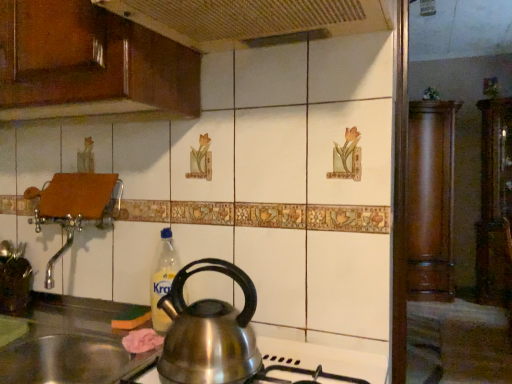
Question: Is shiny metallic kettle at center located within wooden panel at upper left?

Choices:
 (A) yes
 (B) no

Answer: (B)

Question: Is wooden panel at upper left positioned with its back to shiny metallic kettle at center?

Choices:
 (A) yes
 (B) no

Answer: (B)

Question: Considering the relative sizes of wooden panel at upper left and shiny metallic kettle at center in the image provided, is wooden panel at upper left smaller than shiny metallic kettle at center?

Choices:
 (A) yes
 (B) no

Answer: (B)

Question: Can you see wooden panel at upper left touching shiny metallic kettle at center?

Choices:
 (A) no
 (B) yes

Answer: (A)

Question: Is wooden panel at upper left outside shiny metallic kettle at center?

Choices:
 (A) yes
 (B) no

Answer: (A)

Question: Considering the relative sizes of wooden panel at upper left and shiny metallic kettle at center in the image provided, is wooden panel at upper left shorter than shiny metallic kettle at center?

Choices:
 (A) yes
 (B) no

Answer: (A)

Question: Does glossy wood cabinetry at upper left, which is the first cabinetry from left to right, come behind polished stainless steel kettle at lower center?

Choices:
 (A) yes
 (B) no

Answer: (A)

Question: Considering the relative sizes of glossy wood cabinetry at upper left, placed as the 3th cabinetry when sorted from right to left, and polished stainless steel kettle at lower center in the image provided, is glossy wood cabinetry at upper left, placed as the 3th cabinetry when sorted from right to left, wider than polished stainless steel kettle at lower center?

Choices:
 (A) yes
 (B) no

Answer: (B)

Question: Could polished stainless steel kettle at lower center be considered to be inside glossy wood cabinetry at upper left, placed as the 3th cabinetry when sorted from right to left?

Choices:
 (A) no
 (B) yes

Answer: (A)

Question: From the image's perspective, is glossy wood cabinetry at upper left, placed as the third cabinetry when sorted from back to front, beneath polished stainless steel kettle at lower center?

Choices:
 (A) yes
 (B) no

Answer: (B)

Question: Is glossy wood cabinetry at upper left, which is the first cabinetry from left to right, next to polished stainless steel kettle at lower center?

Choices:
 (A) yes
 (B) no

Answer: (B)

Question: Is glossy wood cabinetry at upper left, placed as the third cabinetry when sorted from back to front, turned away from polished stainless steel kettle at lower center?

Choices:
 (A) yes
 (B) no

Answer: (B)

Question: From the image's perspective, is mahogany wood cabinet at right, the second cabinetry in the right-to-left sequence, on top of stainless steel sink at lower left?

Choices:
 (A) no
 (B) yes

Answer: (B)